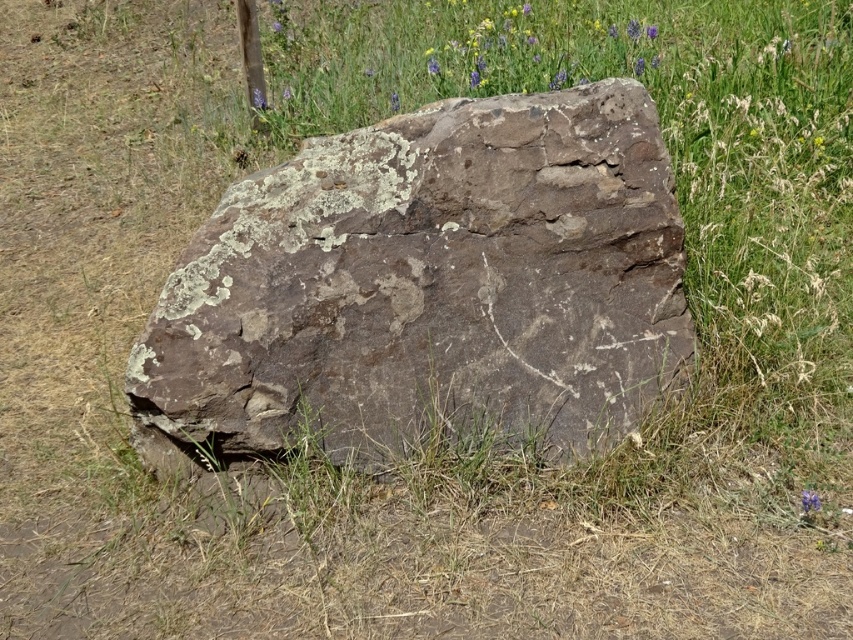
You are a botanist studying the flora and fauna in this natural setting. You notice the brown rough rock at center and the blue textured flowers at upper center. Which object is larger in size?

The brown rough rock at center has a smaller size compared to blue textured flowers at upper center, so the blue textured flowers at upper center are larger in size.

You are standing at the center of the grassy area and see the point marked as point (427, 285). What object is located at that point?

The brown rough rock at center is located at point (427, 285).

You are standing in the natural setting with the large rock. You see two points marked on the rock. The first point is at coordinate point(234, 182) and the second point is at coordinate point(558, 40). From your perspective, which point is closer to you?

Point(234, 182) is in front of point(558, 40), so it is closer to you.